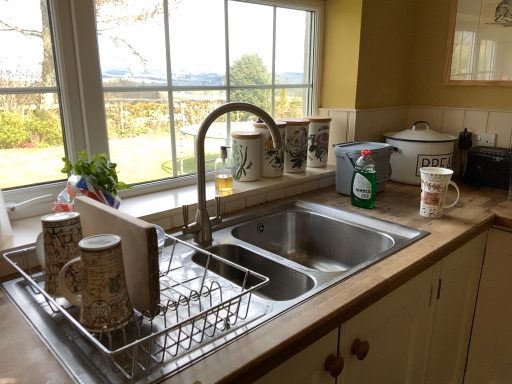
I want to click on free region on the left part of white ceramic mug at right, which ranks as the second mug in front-to-back order, so click(393, 213).